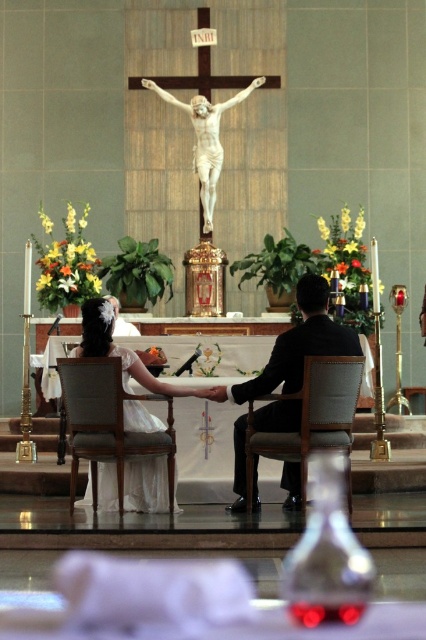
You are a photographer positioned at the back of the church during a wedding ceremony. You need to capture a clear shot of both the white satin dress at center and the light brown leather chair at center. Which object will appear taller in the photo?

The white satin dress at center is taller than the light brown leather chair at center, so it will appear taller in the photo.

You are a photographer positioned behind the altar during a wedding ceremony. You need to capture a closeup shot of the white satin dress at center and the light brown leather chair at center. Which object will require you to zoom in less to fill the frame?

The light brown leather chair at center has a smaller width compared to the white satin dress at center, so to fill the frame with the same level of detail, you would need to zoom in less when focusing on the light brown leather chair at center.

You are a photographer standing behind the altar and want to capture a photo of the white satin dress at center and the light brown fabric chair at center in the same frame. The camera you are using has a minimum focus distance of 2 meters. Will you be able to take the photo without moving either object?

The distance between the white satin dress at center and the light brown fabric chair at center is 1.99 meters, which is less than the camera minimum focus distance of 2 meters. Therefore, you will not be able to capture both objects in focus without moving either object closer or further apart.